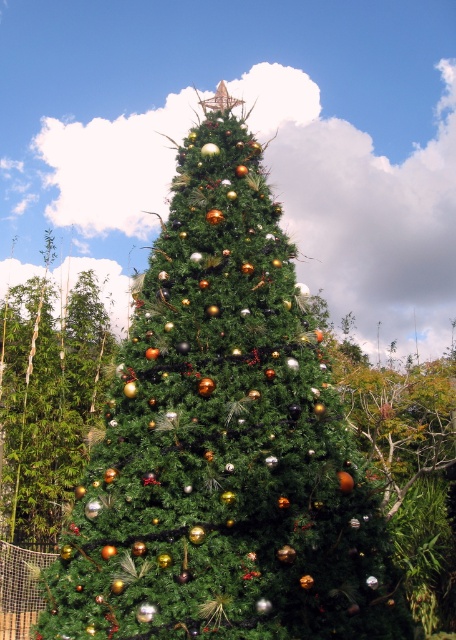
You are standing in front of a large Christmas tree scene. There is a point marked at coordinates (222, 442). Which object from the scene is located exactly at that point?

The point at coordinates (222, 442) is where the green matte christmas tree at center is located.

You are standing in front of the Christmas tree scene described. You want to take a photo of the green matte christmas tree at center without any foreground objects blocking it. Is the distance sufficient for you to step back enough to capture the entire tree in your shot?

The green matte christmas tree at center is 3.21 meters from camera, so stepping back to capture the entire tree without foreground objects blocking it should be possible since the distance is sufficient.

You are a bird perched on a branch observing the green matte christmas tree at center and the shiny gold ornaments at left. Which object is taller?

The green matte christmas tree at center is taller than the shiny gold ornaments at left.